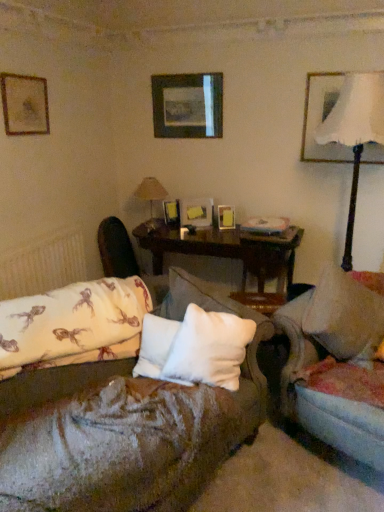
This screenshot has height=512, width=384. What are the coordinates of `metallic gold picture frame at center, the second picture frame from the left` in the screenshot? It's located at (172, 213).

In order to face wooden picture frame at center, which is counted as the fourth picture frame, starting from the right, should I rotate leftwards or rightwards?

Rotate your view left by about 0.539°.

What do you see at coordinates (225, 249) in the screenshot?
I see `wooden polished table at center` at bounding box center [225, 249].

Locate an element on the screen. The height and width of the screenshot is (512, 384). beige fabric table lamp at center, the first table lamp viewed from the left is located at coordinates pos(151,191).

In order to face matte white picture frame at upper right, which appears as the first picture frame when viewed from the right, should I rotate leftwards or rightwards?

Turn right by 19.966 degrees to look at matte white picture frame at upper right, which appears as the first picture frame when viewed from the right.

Locate an element on the screen. The width and height of the screenshot is (384, 512). metallic gold picture frame at center, the second picture frame from the left is located at coordinates (172, 213).

Considering the sizes of objects white textured radiator at lower left and matte white picture frame at upper right, the 6th picture frame in the left-to-right sequence, in the image provided, who is shorter, white textured radiator at lower left or matte white picture frame at upper right, the 6th picture frame in the left-to-right sequence,?

With less height is white textured radiator at lower left.

Is white textured radiator at lower left wider than matte white picture frame at upper right, which appears as the first picture frame when viewed from the right?

Correct, the width of white textured radiator at lower left exceeds that of matte white picture frame at upper right, which appears as the first picture frame when viewed from the right.

Is there a large distance between white textured radiator at lower left and matte white picture frame at upper right, the 6th picture frame in the left-to-right sequence?

Absolutely, white textured radiator at lower left is distant from matte white picture frame at upper right, the 6th picture frame in the left-to-right sequence.

From a real-world perspective, which is physically above, white textured radiator at lower left or matte white picture frame at upper right, the 6th picture frame in the left-to-right sequence?

From a 3D spatial view, matte white picture frame at upper right, the 6th picture frame in the left-to-right sequence, is above.

Does metallic gold picture frame at center, the second picture frame from the left, turn towards beige fabric table lamp at center, the first table lamp viewed from the left?

Yes, metallic gold picture frame at center, the second picture frame from the left, is facing beige fabric table lamp at center, the first table lamp viewed from the left.

From a real-world perspective, is metallic gold picture frame at center, the 5th picture frame when ordered from right to left, beneath beige fabric table lamp at center, marked as the second table lamp in a right-to-left arrangement?

Yes.

Does metallic gold picture frame at center, the second picture frame from the left, touch beige fabric table lamp at center, marked as the second table lamp in a right-to-left arrangement?

No.

Does velvet beige couch at center have a greater width compared to white fabric lampshade at upper right, which appears as the first table lamp when viewed from the front?

Yes.

Could you tell me if velvet beige couch at center is facing white fabric lampshade at upper right, placed as the 1th table lamp when sorted from right to left?

No, velvet beige couch at center is not aimed at white fabric lampshade at upper right, placed as the 1th table lamp when sorted from right to left.

Can you confirm if velvet beige couch at center is bigger than white fabric lampshade at upper right, which appears as the first table lamp when viewed from the front?

Indeed, velvet beige couch at center has a larger size compared to white fabric lampshade at upper right, which appears as the first table lamp when viewed from the front.

Is velvet beige couch at center shorter than white fabric lampshade at upper right, acting as the 2th table lamp starting from the left?

Correct, velvet beige couch at center is not as tall as white fabric lampshade at upper right, acting as the 2th table lamp starting from the left.

How far apart are beige fabric table lamp at center, the first table lamp viewed from the left, and wooden picture frame at center, marked as the fifth picture frame in a left-to-right arrangement?

24.82 inches.

From a real-world perspective, is beige fabric table lamp at center, the first table lamp viewed from the left, located beneath wooden picture frame at center, marked as the fifth picture frame in a left-to-right arrangement?

No, from a real-world perspective, beige fabric table lamp at center, the first table lamp viewed from the left, is not under wooden picture frame at center, marked as the fifth picture frame in a left-to-right arrangement.

Would you say beige fabric table lamp at center, the first table lamp viewed from the left, is to the left or to the right of wooden picture frame at center, the 2th picture frame viewed from the right, in the picture?

beige fabric table lamp at center, the first table lamp viewed from the left, is to the left of wooden picture frame at center, the 2th picture frame viewed from the right.

Looking at this image, which of these two, beige fabric table lamp at center, which is the 2th table lamp from front to back, or wooden picture frame at center, the 2th picture frame viewed from the right, stands taller?

beige fabric table lamp at center, which is the 2th table lamp from front to back.

Is matte white picture frame at upper right, the 6th picture frame in the left-to-right sequence, turned away from beige fabric table lamp at center, which is the 2th table lamp from front to back?

matte white picture frame at upper right, the 6th picture frame in the left-to-right sequence, does not have its back to beige fabric table lamp at center, which is the 2th table lamp from front to back.

Considering the sizes of objects matte white picture frame at upper right, which appears as the first picture frame when viewed from the right, and beige fabric table lamp at center, which is the 2th table lamp from front to back, in the image provided, who is shorter, matte white picture frame at upper right, which appears as the first picture frame when viewed from the right, or beige fabric table lamp at center, which is the 2th table lamp from front to back,?

beige fabric table lamp at center, which is the 2th table lamp from front to back.

Considering the relative sizes of matte white picture frame at upper right, the 6th picture frame in the left-to-right sequence, and beige fabric table lamp at center, marked as the second table lamp in a right-to-left arrangement, in the image provided, is matte white picture frame at upper right, the 6th picture frame in the left-to-right sequence, bigger than beige fabric table lamp at center, marked as the second table lamp in a right-to-left arrangement,?

Incorrect, matte white picture frame at upper right, the 6th picture frame in the left-to-right sequence, is not larger than beige fabric table lamp at center, marked as the second table lamp in a right-to-left arrangement.

What's the angular difference between matte white picture frame at upper right, the 6th picture frame in the left-to-right sequence, and beige fabric table lamp at center, which is the 2th table lamp from front to back,'s facing directions?

matte white picture frame at upper right, the 6th picture frame in the left-to-right sequence, and beige fabric table lamp at center, which is the 2th table lamp from front to back, are facing 0.00169 degrees away from each other.

Does beige fabric table lamp at center, marked as the second table lamp in a right-to-left arrangement, touch white soft pillow at center, the first pillow positioned from the right?

beige fabric table lamp at center, marked as the second table lamp in a right-to-left arrangement, is not next to white soft pillow at center, the first pillow positioned from the right, and they're not touching.

Which is closer to the camera, (140, 193) or (227, 319)?

The point (227, 319) is in front.

Is beige fabric table lamp at center, the 1th table lamp positioned from the back, taller or shorter than white soft pillow at center, the first pillow positioned from the right?

Clearly, beige fabric table lamp at center, the 1th table lamp positioned from the back, is shorter compared to white soft pillow at center, the first pillow positioned from the right.

Considering their positions, is beige fabric table lamp at center, the first table lamp viewed from the left, located in front of or behind white soft pillow at center, placed as the 2th pillow when sorted from left to right?

Visually, beige fabric table lamp at center, the first table lamp viewed from the left, is located behind white soft pillow at center, placed as the 2th pillow when sorted from left to right.

Between velvet beige couch at center and metallic gold picture frame at center, the second picture frame from the left, which one is positioned behind?

metallic gold picture frame at center, the second picture frame from the left, is further from the camera.

Which is closer to the camera, (303, 386) or (179, 218)?

The point (303, 386) is closer to the camera.

Does velvet beige couch at center have a lesser height compared to metallic gold picture frame at center, the second picture frame from the left?

Incorrect, the height of velvet beige couch at center does not fall short of that of metallic gold picture frame at center, the second picture frame from the left.

Locate an element on the screen. This screenshot has width=384, height=512. picture frame that is the 4th one when counting leftward from the velvet beige couch at center is located at coordinates (172, 213).

Image resolution: width=384 pixels, height=512 pixels. I want to click on the 4th picture frame positioned above the white textured radiator at lower left (from a real-world perspective), so click(321, 118).

What are the coordinates of `the 3rd picture frame behind the beige fabric table lamp at center, marked as the second table lamp in a right-to-left arrangement` in the screenshot? It's located at (172, 213).

Considering their positions, is white soft pillow at center, the first pillow positioned from the right, positioned closer to white fabric lampshade at upper right, which appears as the first table lamp when viewed from the front, than matte white picture frame at upper right, which appears as the first picture frame when viewed from the right?

matte white picture frame at upper right, which appears as the first picture frame when viewed from the right, lies closer to white fabric lampshade at upper right, which appears as the first table lamp when viewed from the front, than the other object.

Looking at the image, which one is located further to wooden picture frame at center, marked as the fifth picture frame in a left-to-right arrangement, velvet dark brown swivel chair at center or white soft pillow at center, which is the second pillow from right to left?

white soft pillow at center, which is the second pillow from right to left, lies further to wooden picture frame at center, marked as the fifth picture frame in a left-to-right arrangement, than the other object.

Considering their positions, is matte white picture frame at upper right, which appears as the first picture frame when viewed from the right, positioned further to white fabric lampshade at upper right, placed as the 1th table lamp when sorted from right to left, than wooden picture frame at center, positioned as the 3th picture frame in left-to-right order?

Based on the image, wooden picture frame at center, positioned as the 3th picture frame in left-to-right order, appears to be further to white fabric lampshade at upper right, placed as the 1th table lamp when sorted from right to left.

From the image, which object appears to be farther from wooden picture frame at upper left, which appears as the 1th picture frame when viewed from the left, white fabric lampshade at upper right, placed as the 1th table lamp when sorted from right to left, or wooden polished table at center?

The object further to wooden picture frame at upper left, which appears as the 1th picture frame when viewed from the left, is white fabric lampshade at upper right, placed as the 1th table lamp when sorted from right to left.

When comparing their distances from white soft pillow at center, which is the second pillow from right to left, does matte white picture frame at upper right, the 6th picture frame in the left-to-right sequence, or wooden picture frame at upper left, the sixth picture frame viewed from the right, seem further?

Among the two, matte white picture frame at upper right, the 6th picture frame in the left-to-right sequence, is located further to white soft pillow at center, which is the second pillow from right to left.

Which object lies further to the anchor point white soft pillow at center, which is the second pillow from right to left, wooden polished table at center or metallic gold picture frame at center, the second picture frame from the left?

Based on the image, metallic gold picture frame at center, the second picture frame from the left, appears to be further to white soft pillow at center, which is the second pillow from right to left.

Consider the image. When comparing their distances from wooden polished table at center, does velvet dark brown swivel chair at center or matte white picture frame at upper right, the 6th picture frame in the left-to-right sequence, seem closer?

velvet dark brown swivel chair at center lies closer to wooden polished table at center than the other object.

Which object lies nearer to the anchor point metallic gold picture frame at center, the second picture frame from the left, wooden picture frame at center, the 2th picture frame viewed from the right, or beige fabric table lamp at center, the 1th table lamp positioned from the back?

beige fabric table lamp at center, the 1th table lamp positioned from the back, is positioned closer to the anchor metallic gold picture frame at center, the second picture frame from the left.

Locate an element on the screen. The image size is (384, 512). table between white soft pillow at center, placed as the first pillow when sorted from left to right, and white fabric lampshade at upper right, the second table lamp when ordered from back to front, from left to right is located at coordinates (225, 249).

In order to click on table between white soft pillow at center, placed as the 2th pillow when sorted from left to right, and matte wooden picture frame at center, the 3th picture frame from the right, in the front-back direction in this screenshot , I will do `click(225, 249)`.

The width and height of the screenshot is (384, 512). What are the coordinates of `table between wooden picture frame at upper left, the sixth picture frame viewed from the right, and white soft pillow at center, placed as the 2th pillow when sorted from left to right, from top to bottom` in the screenshot? It's located at (225, 249).

At what (x,y) coordinates should I click in order to perform the action: click on table located between white textured radiator at lower left and white fabric lampshade at upper right, placed as the 1th table lamp when sorted from right to left, in the left-right direction. Please return your answer as a coordinate pair (x, y). Looking at the image, I should click on (225, 249).